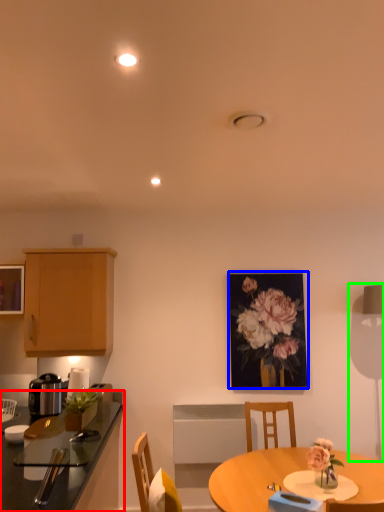
Question: Considering the real-world distances, which object is closest to countertop (highlighted by a red box)? picture frame (highlighted by a blue box) or table lamp (highlighted by a green box).

Choices:
 (A) picture frame
 (B) table lamp

Answer: (A)